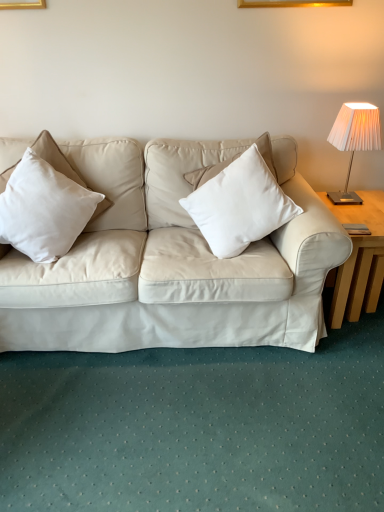
Question: Does point (205, 229) appear closer or farther from the camera than point (355, 265)?

Choices:
 (A) farther
 (B) closer

Answer: (B)

Question: From a real-world perspective, is white matte pillow at center, acting as the second pillow starting from the left, positioned above or below light wood table at right?

Choices:
 (A) below
 (B) above

Answer: (B)

Question: Which of these objects is positioned closest to the white matte pillow at center, acting as the second pillow starting from the left?

Choices:
 (A) light wood table at right
 (B) white pleated fabric lampshade at upper right
 (C) white cotton pillow at left, marked as the 1th pillow in a left-to-right arrangement

Answer: (A)

Question: Considering the real-world distances, which object is farthest from the light wood table at right?

Choices:
 (A) white cotton pillow at left, marked as the 1th pillow in a left-to-right arrangement
 (B) white matte pillow at center, acting as the second pillow starting from the left
 (C) white pleated fabric lampshade at upper right

Answer: (A)